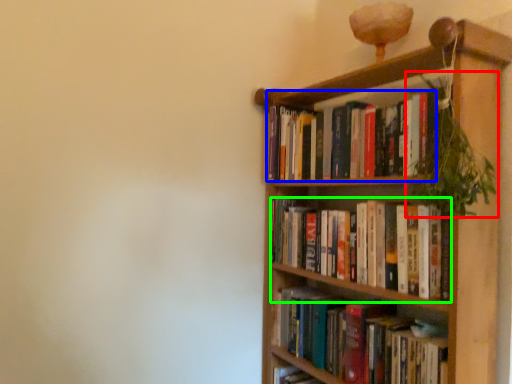
Question: Which object is the farthest from vegetation (highlighted by a red box)? Choose among these: book (highlighted by a blue box) or book (highlighted by a green box).

Choices:
 (A) book
 (B) book

Answer: (B)